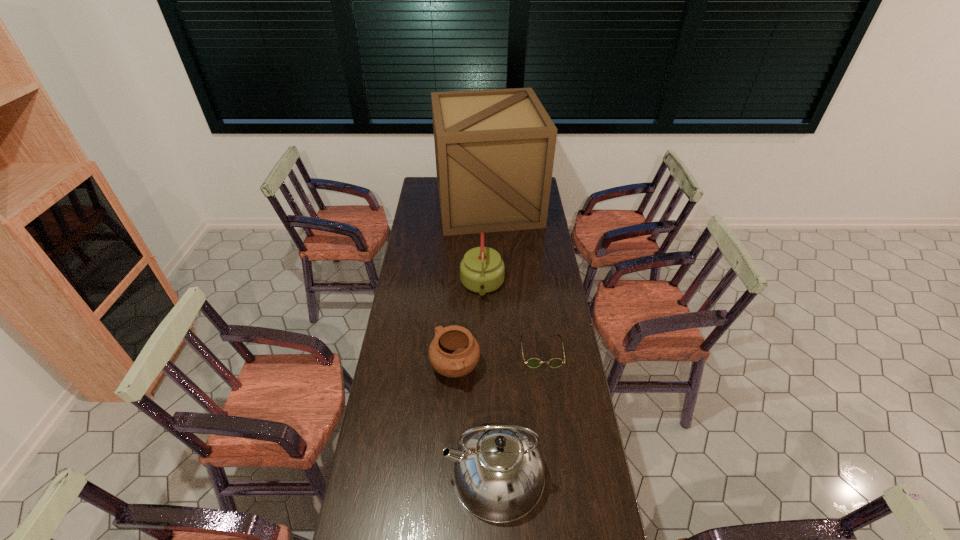
The image size is (960, 540). In order to click on the farthest object in this screenshot , I will do `click(494, 149)`.

Locate an element on the screen. This screenshot has width=960, height=540. the tallest object is located at coordinates (494, 149).

Locate an element on the screen. The image size is (960, 540). the taller kettle is located at coordinates (499, 472).

Locate an element on the screen. the nearest object is located at coordinates (499, 472).

Find the location of `the shorter kettle`. the shorter kettle is located at coordinates [x=482, y=270].

Identify the location of the farther kettle. (482, 270).

You are a GUI agent. You are given a task and a screenshot of the screen. Output one action in this format:
    pyautogui.click(x=<x>, y=<y>)
    Task: Click on the second shortest object
    The height and width of the screenshot is (540, 960).
    Given the screenshot: What is the action you would take?
    click(x=454, y=352)

Where is `spectacles`? The width and height of the screenshot is (960, 540). spectacles is located at coordinates (533, 362).

The height and width of the screenshot is (540, 960). What are the coordinates of `vacant region located 0.260m on the front of the tallest object` in the screenshot? It's located at (490, 267).

Locate an element on the screen. free region located from the spout of the taller kettle is located at coordinates (413, 474).